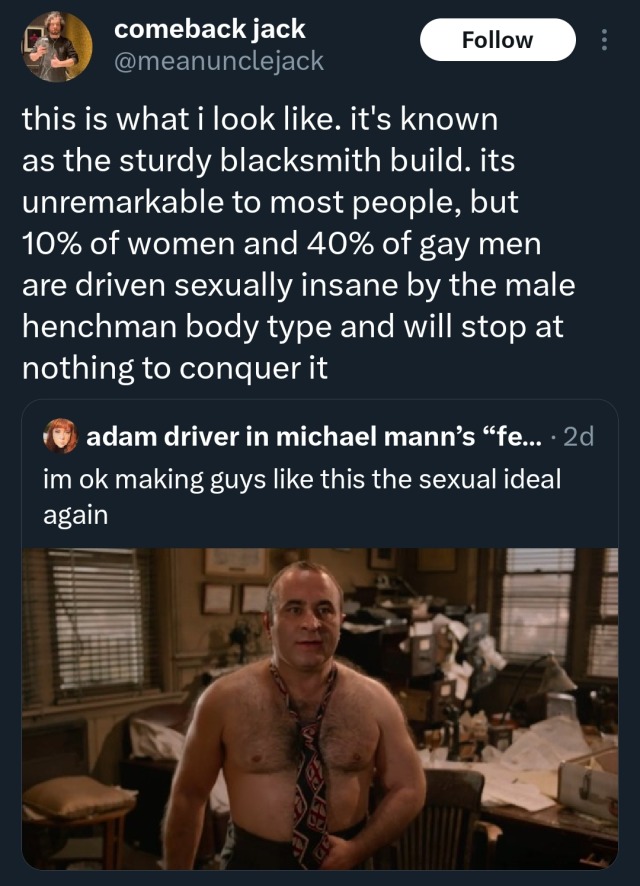
Find the location of a particular element. light brown pillow is located at coordinates (68, 795).